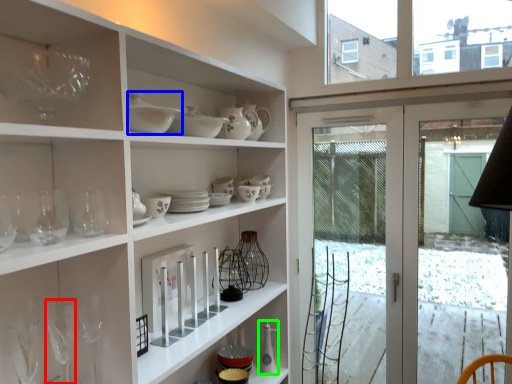
Question: Based on their relative distances, which object is nearer to wine glass (highlighted by a red box)? Choose from tableware (highlighted by a blue box) and tableware (highlighted by a green box).

Choices:
 (A) tableware
 (B) tableware

Answer: (A)